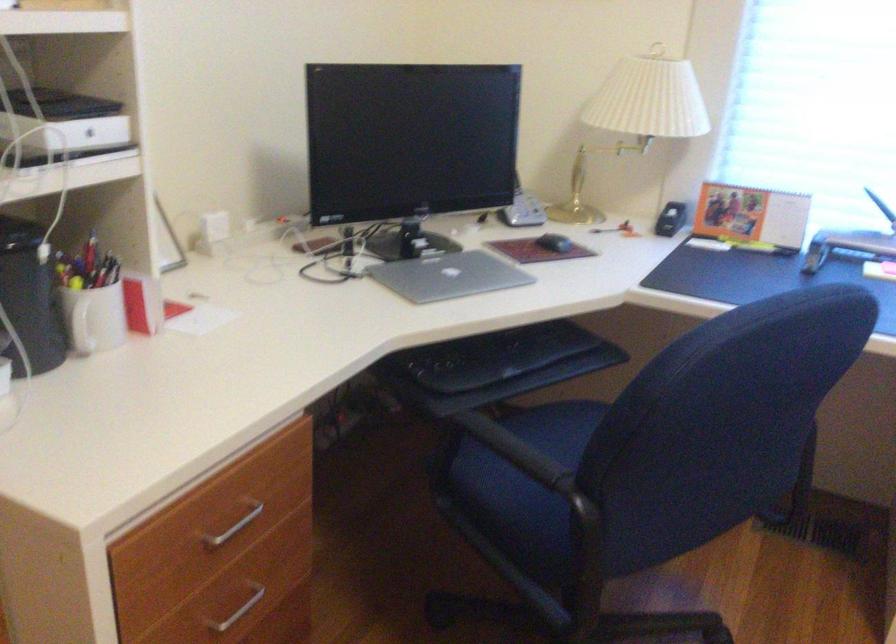
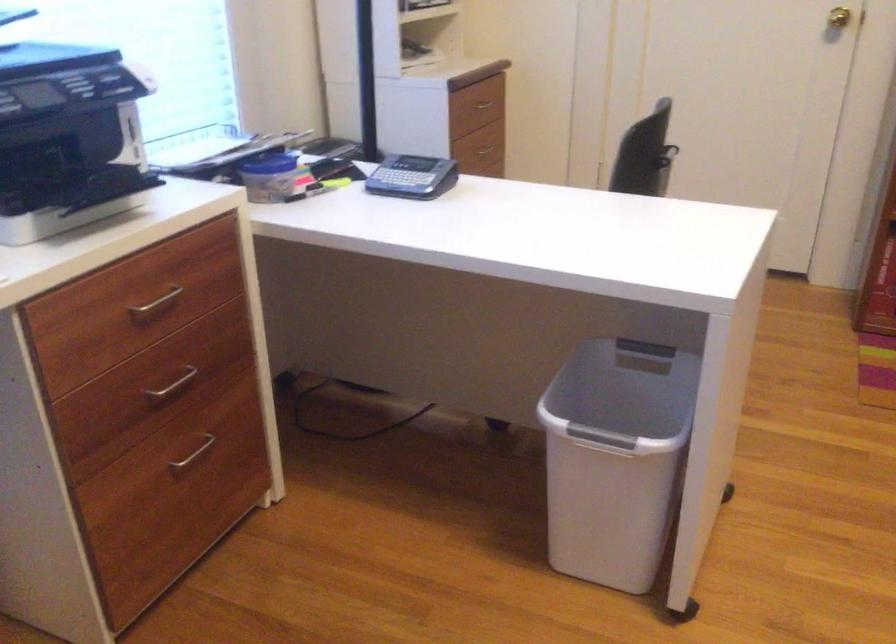
Based on the continuous images, in which direction is the camera rotating?

The camera rotated toward right-down.